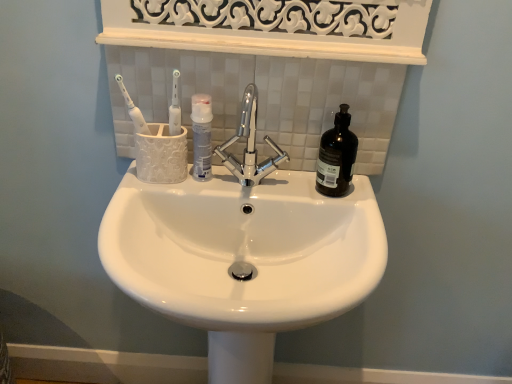
Find the location of `vacant area that lies between black glass bottle at right, arranged as the second mouthwash when viewed from the left, and white matte mouthwash at center, acting as the 2th mouthwash starting from the right`. vacant area that lies between black glass bottle at right, arranged as the second mouthwash when viewed from the left, and white matte mouthwash at center, acting as the 2th mouthwash starting from the right is located at coordinates (262, 175).